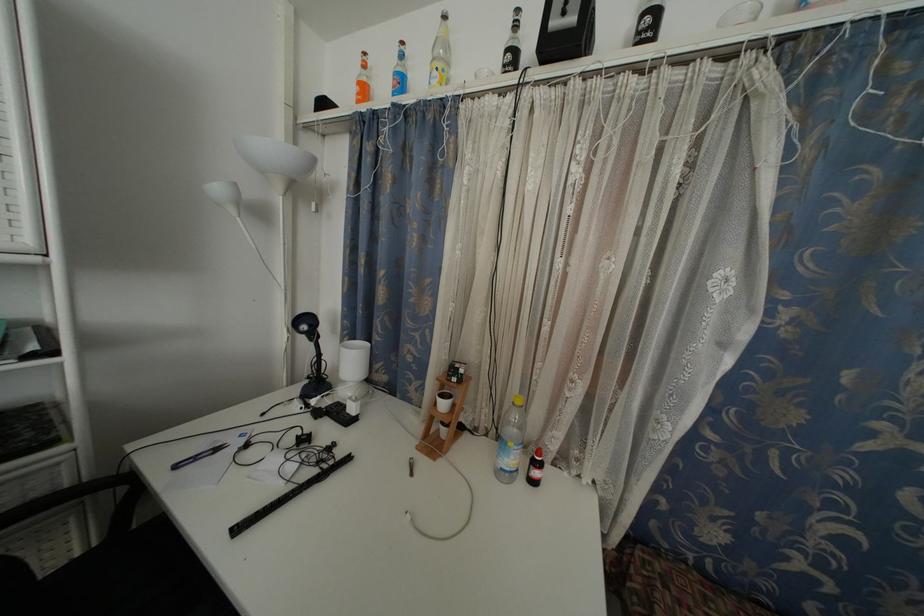
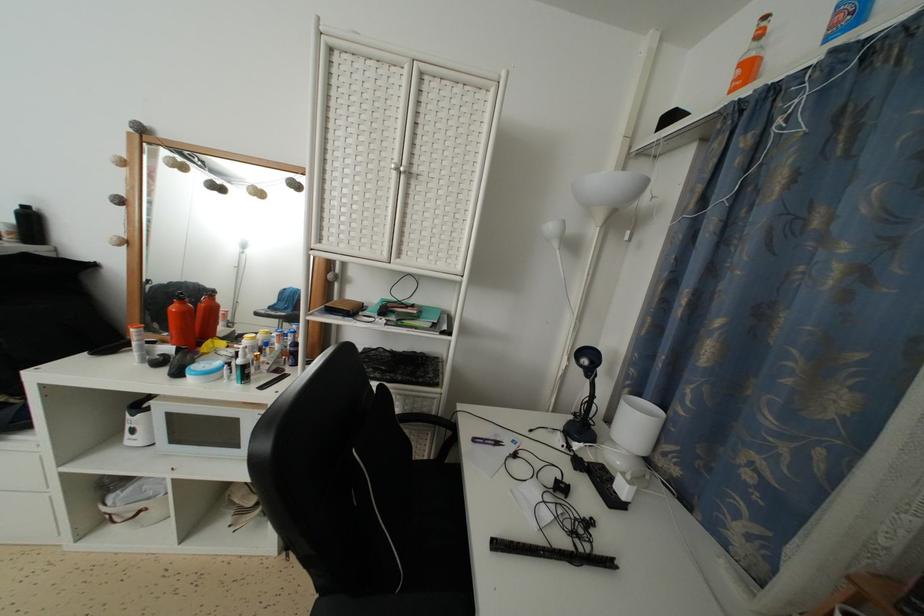
Locate, in the second image, the point that corresponds to (351,464) in the first image.

(614, 569)